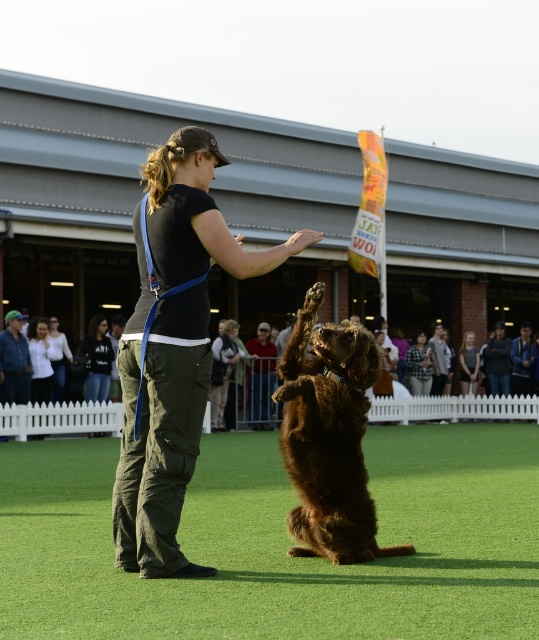
This screenshot has height=640, width=539. What do you see at coordinates (172, 346) in the screenshot? I see `black cotton shirt at center` at bounding box center [172, 346].

Locate an element on the screen. Image resolution: width=539 pixels, height=640 pixels. black cotton shirt at center is located at coordinates (172, 346).

Is point (319, 333) positioned after point (63, 390)?

No, it is not.

Does brown furry dog at center have a larger size compared to white cotton shirt at center?

Yes, brown furry dog at center is bigger than white cotton shirt at center.

Describe the element at coordinates (328, 436) in the screenshot. I see `brown furry dog at center` at that location.

Identify the location of brown furry dog at center. (328, 436).

Does white shirt at center appear under matte black shirt at center?

Incorrect, white shirt at center is not positioned below matte black shirt at center.

In the scene shown: Does white shirt at center have a lesser width compared to matte black shirt at center?

Incorrect, white shirt at center's width is not less than matte black shirt at center's.

Identify the location of white shirt at center. The width and height of the screenshot is (539, 640). (40, 358).

Locate an element on the screen. The width and height of the screenshot is (539, 640). white shirt at center is located at coordinates (40, 358).